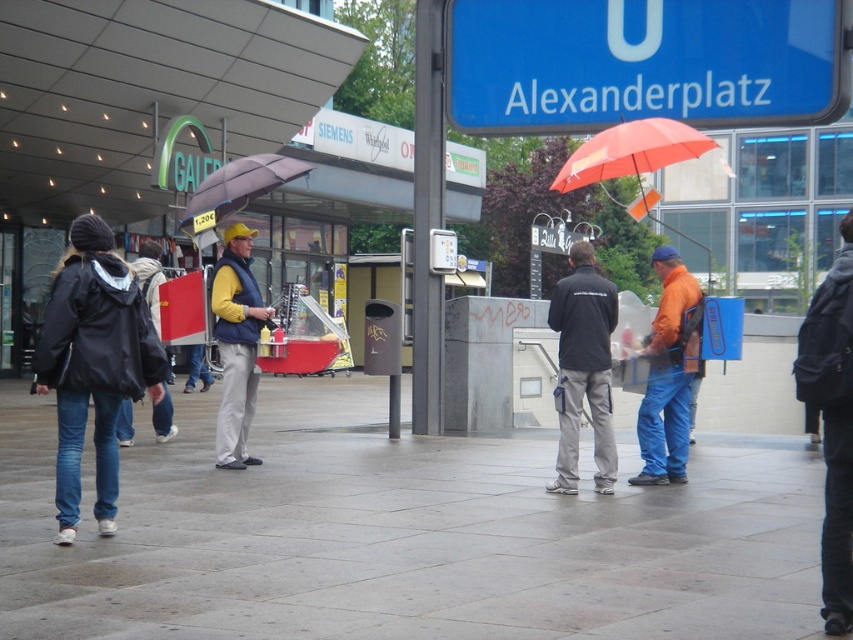
You are standing at the center of Alexanderplatz and want to place a small bench between the gray concrete pavement at center and the orange fabric umbrella at upper center. Which object should the bench be closer to to ensure it is visible from your current position?

The bench should be closer to the gray concrete pavement at center because it is closer to the viewer than the orange fabric umbrella at upper center, making it more visible from your current position.